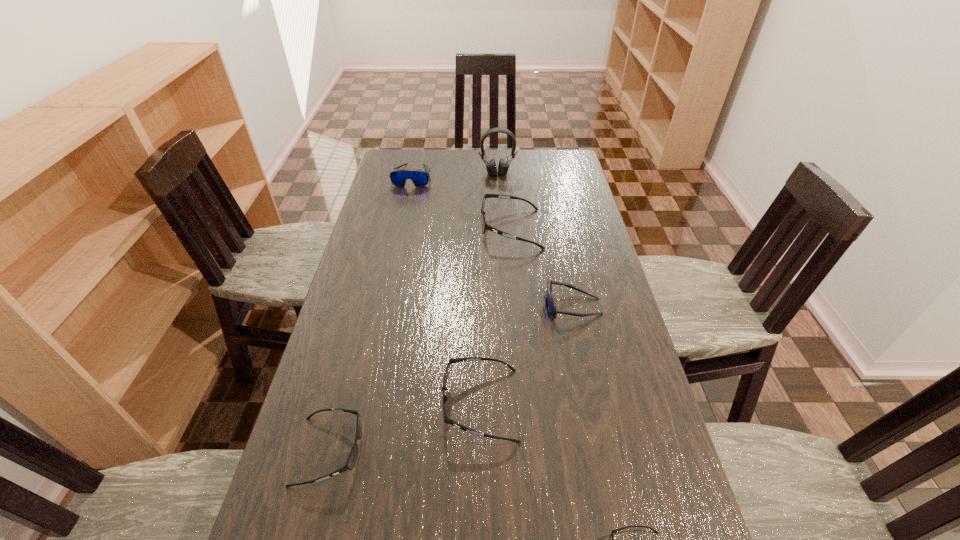
The height and width of the screenshot is (540, 960). I want to click on gray sunglasses that is the fourth nearest to the fourth nearest object, so click(x=351, y=461).

Image resolution: width=960 pixels, height=540 pixels. Identify the location of the closest blue sunglasses to the second biggest gray sunglasses. (550, 305).

I want to click on vacant space that satisfies the following two spatial constraints: 1. on the front-facing side of the farther blue sunglasses; 2. on the front-facing side of the leftmost gray sunglasses, so click(353, 451).

In order to click on free space in the image that satisfies the following two spatial constraints: 1. on the front-facing side of the tallest object; 2. on the front-facing side of the second biggest gray sunglasses in this screenshot , I will do `click(511, 404)`.

At what (x,y) coordinates should I click in order to perform the action: click on free spot that satisfies the following two spatial constraints: 1. on the front-facing side of the headset; 2. on the front-facing side of the third smallest gray sunglasses. Please return your answer as a coordinate pair (x, y). The image size is (960, 540). Looking at the image, I should click on (511, 404).

Identify the location of vacant region that satisfies the following two spatial constraints: 1. on the front-facing side of the headset; 2. on the front-facing side of the leftmost gray sunglasses. (513, 451).